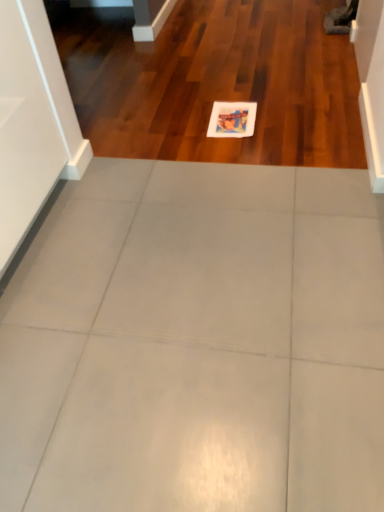
The height and width of the screenshot is (512, 384). What do you see at coordinates (197, 343) in the screenshot?
I see `white smooth concrete at center` at bounding box center [197, 343].

Locate an element on the screen. This screenshot has width=384, height=512. white smooth concrete at center is located at coordinates (197, 343).

The height and width of the screenshot is (512, 384). I want to click on white smooth concrete at center, so click(x=197, y=343).